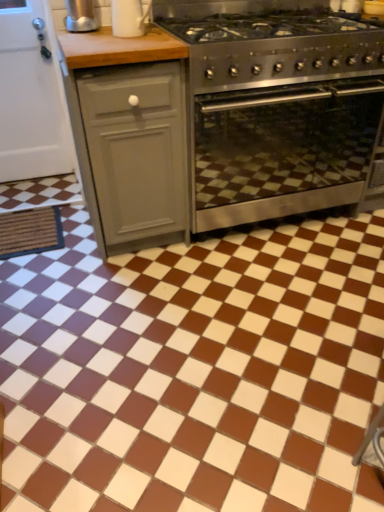
Question: Is stainless steel oven at center oriented away from gray matte cabinet at left?

Choices:
 (A) no
 (B) yes

Answer: (A)

Question: Is stainless steel oven at center oriented towards gray matte cabinet at left?

Choices:
 (A) yes
 (B) no

Answer: (B)

Question: Is stainless steel oven at center outside of gray matte cabinet at left?

Choices:
 (A) no
 (B) yes

Answer: (B)

Question: Does stainless steel oven at center have a lesser height compared to gray matte cabinet at left?

Choices:
 (A) yes
 (B) no

Answer: (A)

Question: From a real-world perspective, is stainless steel oven at center positioned under gray matte cabinet at left based on gravity?

Choices:
 (A) no
 (B) yes

Answer: (B)

Question: Can you confirm if stainless steel oven at center is smaller than gray matte cabinet at left?

Choices:
 (A) yes
 (B) no

Answer: (B)

Question: Is stainless steel gas stove at center oriented away from stainless steel oven at center?

Choices:
 (A) no
 (B) yes

Answer: (A)

Question: Could you tell me if stainless steel gas stove at center is turned towards stainless steel oven at center?

Choices:
 (A) no
 (B) yes

Answer: (A)

Question: Is stainless steel gas stove at center to the left of stainless steel oven at center from the viewer's perspective?

Choices:
 (A) yes
 (B) no

Answer: (A)

Question: From the image's perspective, would you say stainless steel gas stove at center is positioned over stainless steel oven at center?

Choices:
 (A) no
 (B) yes

Answer: (B)

Question: Is stainless steel gas stove at center positioned far away from stainless steel oven at center?

Choices:
 (A) no
 (B) yes

Answer: (A)

Question: Does stainless steel gas stove at center have a larger size compared to stainless steel oven at center?

Choices:
 (A) yes
 (B) no

Answer: (B)

Question: Is satin silver kettle at upper left touching brown glossy tile at center?

Choices:
 (A) no
 (B) yes

Answer: (A)